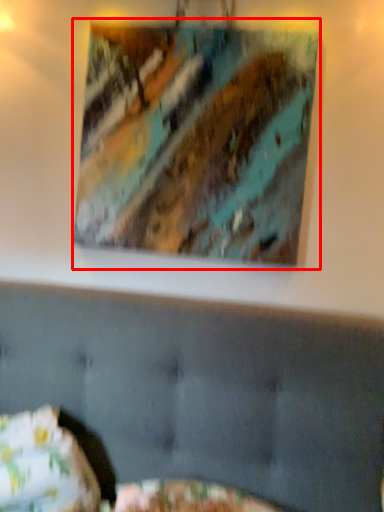
Question: From the image's perspective, considering the relative positions of picture frame (annotated by the red box) and pillow in the image provided, where is picture frame (annotated by the red box) located with respect to the staircase?

Choices:
 (A) above
 (B) below

Answer: (A)